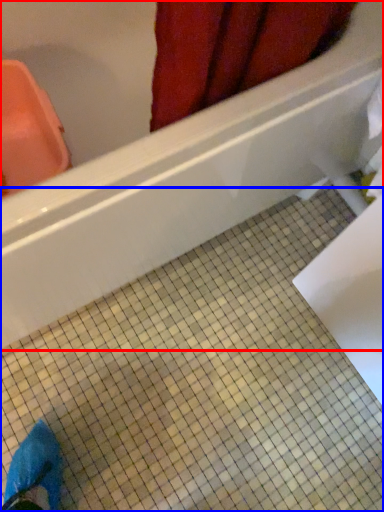
Question: Among these objects, which one is nearest to the camera, bathtub (highlighted by a red box) or ceramic tile (highlighted by a blue box)?

Choices:
 (A) bathtub
 (B) ceramic tile

Answer: (A)